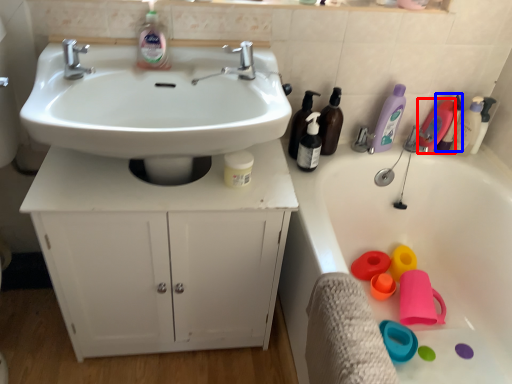
Question: Which point is closer to the camera, cleaning product (highlighted by a red box) or cleaning product (highlighted by a blue box)?

Choices:
 (A) cleaning product
 (B) cleaning product

Answer: (B)